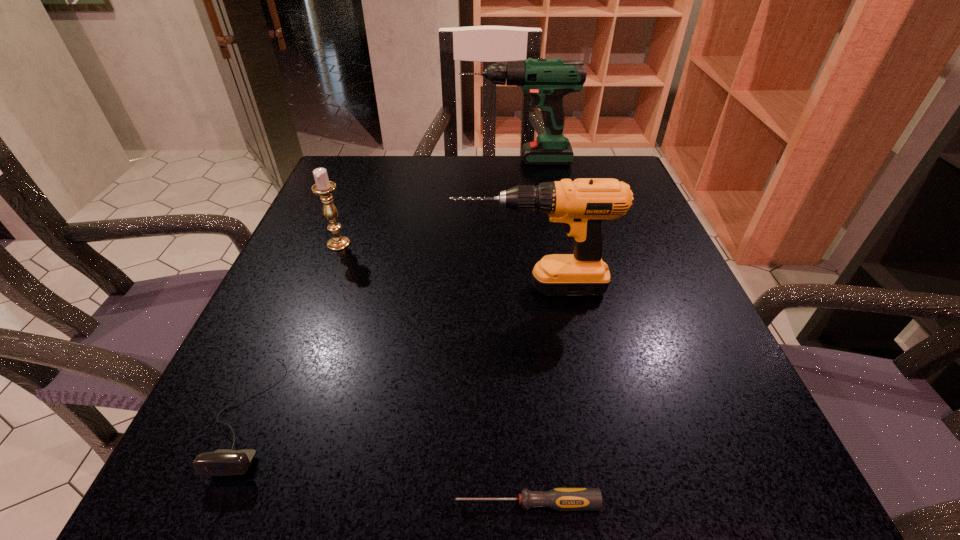
Find the location of a particular element. This screenshot has height=540, width=960. the farthest object is located at coordinates (547, 80).

Find the location of `the nearer drill`. the nearer drill is located at coordinates (581, 205).

Where is `the third shortest object`? The image size is (960, 540). the third shortest object is located at coordinates (323, 187).

The height and width of the screenshot is (540, 960). Identify the location of the second farthest object. (323, 187).

This screenshot has height=540, width=960. I want to click on the fourth farthest object, so click(224, 462).

Identify the location of the fourth tallest object. (224, 462).

In order to click on screwdriver in this screenshot , I will do `click(562, 499)`.

Locate an element on the screen. the nearest object is located at coordinates (562, 499).

The height and width of the screenshot is (540, 960). In order to click on vacant space situated on the handle side of the farthest object in this screenshot , I will do `click(364, 160)`.

In order to click on vacant region located 0.250m on the handle side of the farthest object in this screenshot , I will do `click(364, 160)`.